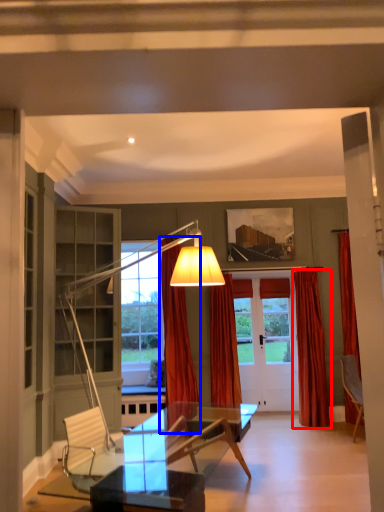
Question: Which of the following is the closest to the observer, curtain (highlighted by a red box) or curtain (highlighted by a blue box)?

Choices:
 (A) curtain
 (B) curtain

Answer: (B)